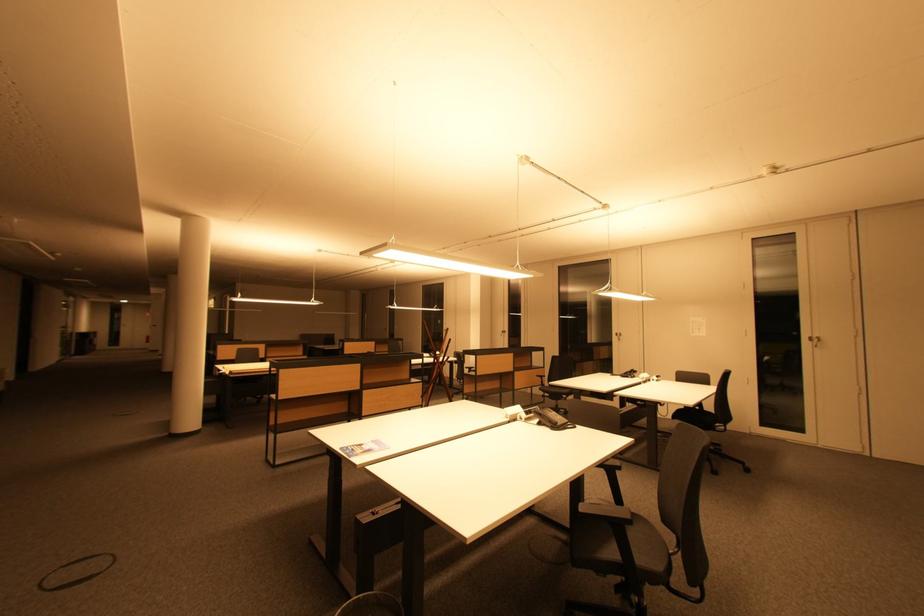
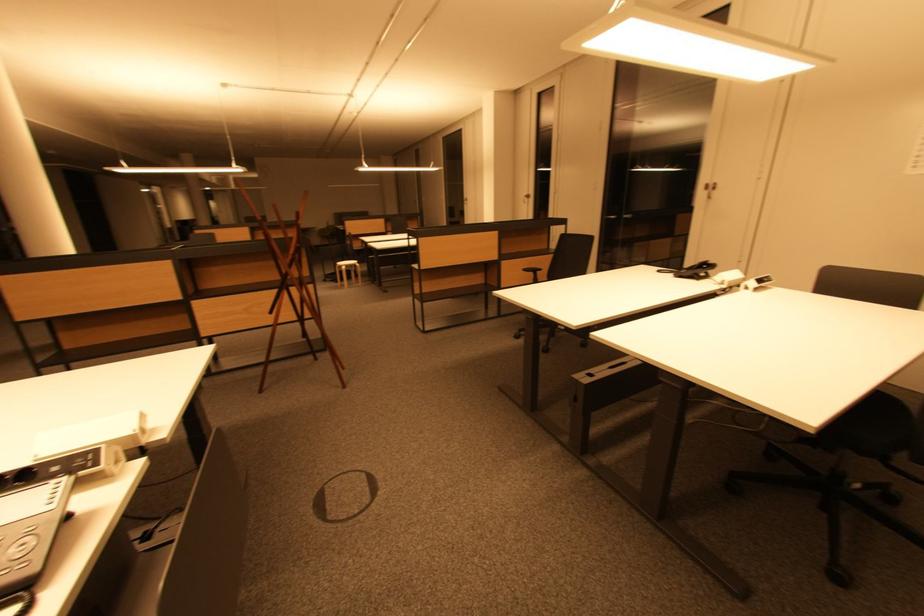
The images are taken continuously from a first-person perspective. In which direction are you moving?

The cameraman walked toward right, forward.